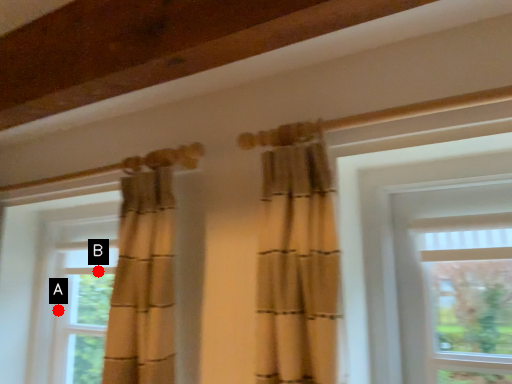
Question: Two points are circled on the image, labeled by A and B beside each circle. Which of the following is the farthest from the observer?

Choices:
 (A) A is further
 (B) B is further

Answer: (A)